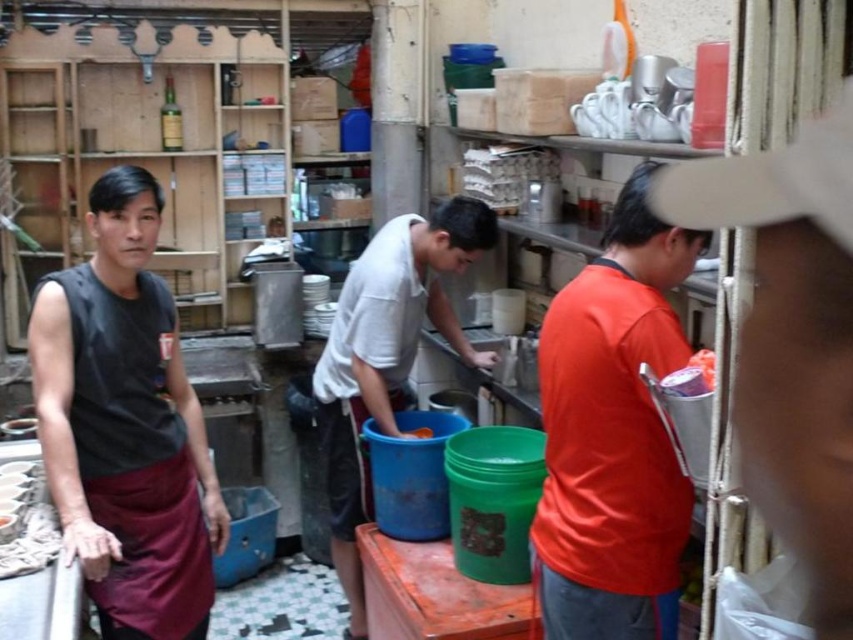
Question: Which point is closer to the camera?

Choices:
 (A) orange matte shirt at right
 (B) white matte shirt at center
 (C) blue plastic bucket at center

Answer: (A)

Question: Can you confirm if black sleeveless shirt at left is smaller than white matte shirt at center?

Choices:
 (A) yes
 (B) no

Answer: (A)

Question: Which object appears closest to the camera in this image?

Choices:
 (A) blue plastic bucket at center
 (B) orange matte shirt at right
 (C) black sleeveless shirt at left

Answer: (B)

Question: Considering the real-world distances, which object is farthest from the white matte shirt at center?

Choices:
 (A) black sleeveless shirt at left
 (B) orange matte shirt at right

Answer: (B)

Question: Is orange matte shirt at right positioned before white matte shirt at center?

Choices:
 (A) no
 (B) yes

Answer: (B)

Question: Does black sleeveless shirt at left appear under orange matte shirt at right?

Choices:
 (A) yes
 (B) no

Answer: (B)